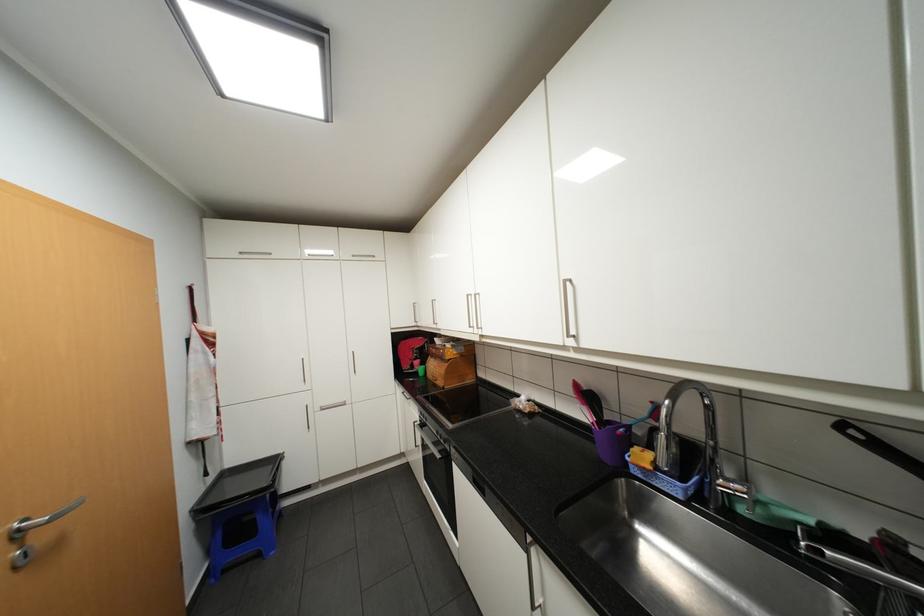
What do you see at coordinates (419, 429) in the screenshot? Image resolution: width=924 pixels, height=616 pixels. I see `the oven door handle` at bounding box center [419, 429].